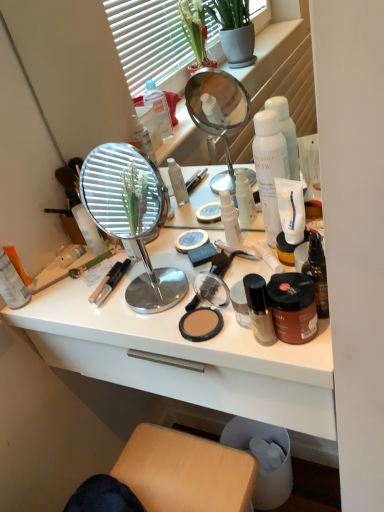
Identify the location of vacant space that's between matte black foundation at center, placed as the 3th toiletry when sorted from left to right, and matte black brush at lower left. (116, 295).